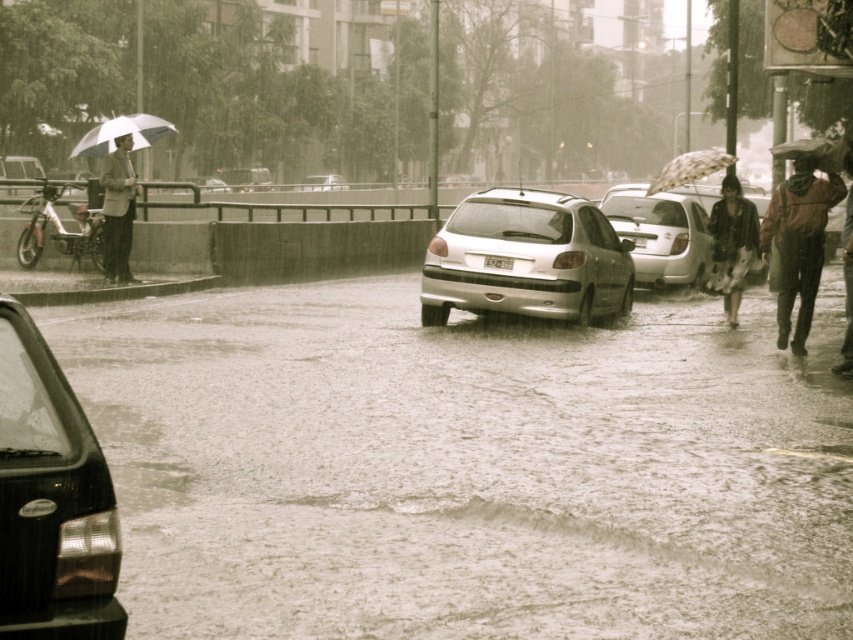
You are a pedestrian trying to cross the flooded street. You see the satin silver hatchback at center and the floral dress at lower right. Which object is closer to the left side of the road?

The satin silver hatchback at center is to the left of the floral dress at lower right, so it is closer to the left side of the road.

You are a pedestrian trying to cross the flooded street. You see the satin silver hatchback at center and the floral dress at lower right. Which object is larger in size?

The satin silver hatchback at center is bigger than the floral dress at lower right.

You are a pedestrian trying to cross the street in the rain. You see the satin silver car at center and the transparent fabric umbrella at upper right. Which object is closer to your right side?

The transparent fabric umbrella at upper right is closer to your right side because it is positioned to the right of the satin silver car at center.